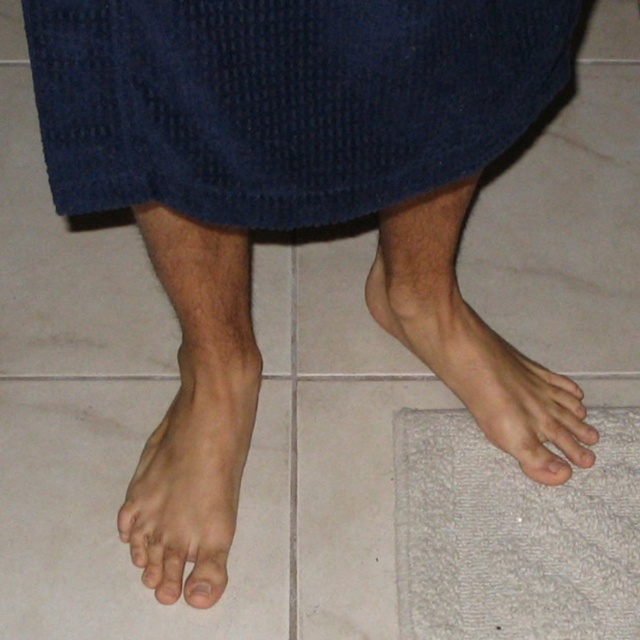
You are a designer creating a layout for a bathroom. You need to place a skinny white foot at lower left and a white textured bath mat at lower right in the design. Given that the foot is larger than the bath mat, which object should be placed closer to the shower exit to ensure proper functionality?

The skinny white foot at lower left is larger in size than the white textured bath mat at lower right, so the bath mat should be placed closer to the shower exit to accommodate the foot size for drying.

You are a physical therapist assessing a patient who just had surgery on their left foot. You need to measure the distance between the skinny white foot at lower left and the smooth skin toe at lower left to ensure proper healing. Can you confirm if the distance is more than 6 inches?

The distance between the skinny white foot at lower left and the smooth skin toe at lower left is 7.17 inches, which is more than 6 inches. Therefore, the distance is sufficient for proper healing.